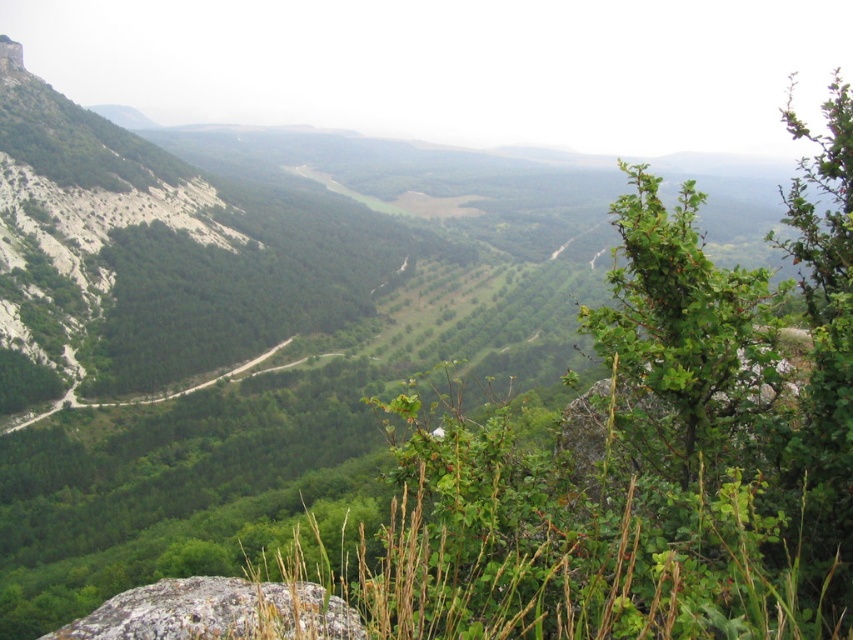
Does gray rough rock at lower left have a smaller size compared to smooth rock peak at upper left?

Actually, gray rough rock at lower left might be larger than smooth rock peak at upper left.

Between point (293, 584) and point (4, 36), which one is positioned behind?

Point (4, 36)

The height and width of the screenshot is (640, 853). Find the location of `gray rough rock at lower left`. gray rough rock at lower left is located at coordinates (218, 612).